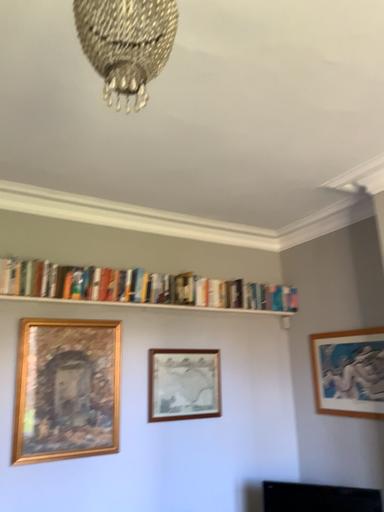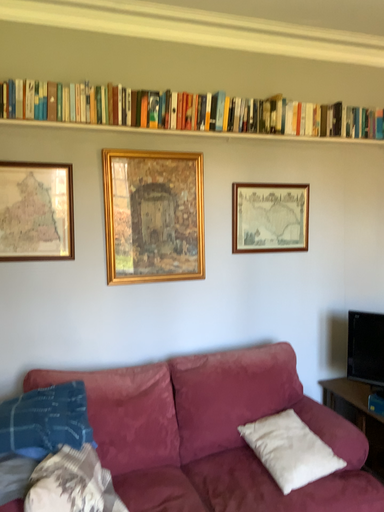
Question: Which way did the camera rotate in the video?

Choices:
 (A) rotated left
 (B) rotated right

Answer: (A)